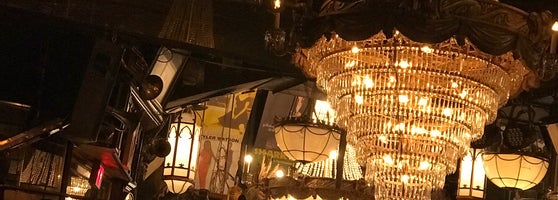
Locate an element on the screen. chandelier chain is located at coordinates (530, 112), (509, 114), (291, 105), (314, 112).